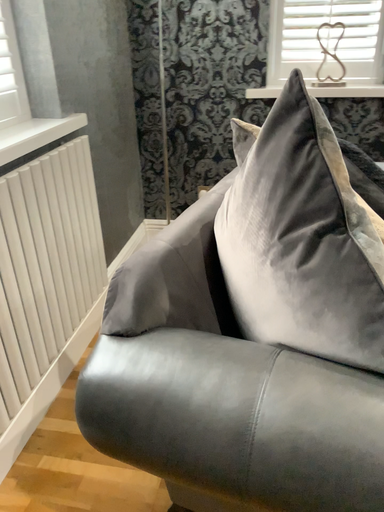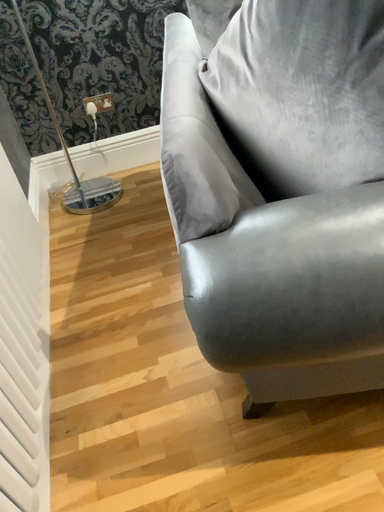
Question: How did the camera likely rotate when shooting the video?

Choices:
 (A) rotated left
 (B) rotated right

Answer: (B)